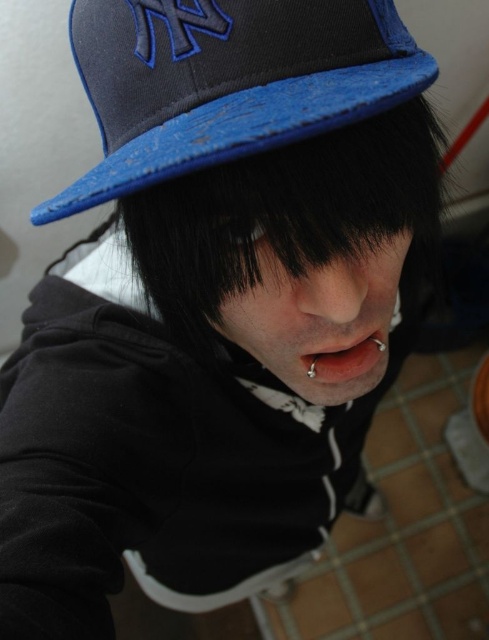
You are standing in front of the person in the image and want to determine which of the two points, point 1 at coordinates point (416, 83) or point 2 at coordinates point (318, 380), is closer to you. Based on the spatial relationships in the scene, which point is nearer?

Point 1 at coordinates point (416, 83) is closer to the viewer than point 2 at coordinates point (318, 380).

You are a photographer setting up for a portrait. You notice the blue fabric baseball cap at upper center and the smooth flesh lips at center in the frame. Which object occupies more horizontal space in the image?

The blue fabric baseball cap at upper center has a greater width than the smooth flesh lips at center, so it occupies more horizontal space in the image.